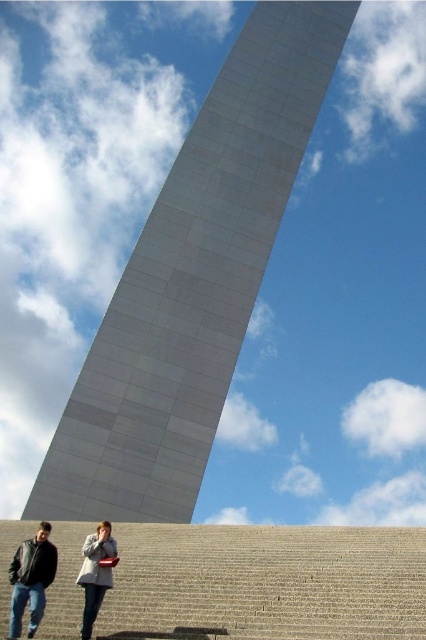
Does gray concrete stairs at lower center have a greater width compared to light gray wool coat at lower center?

Correct, the width of gray concrete stairs at lower center exceeds that of light gray wool coat at lower center.

Identify the location of gray concrete stairs at lower center. This screenshot has height=640, width=426. point(267,582).

Who is more distant from viewer, (371, 608) or (109, 586)?

Positioned behind is point (109, 586).

Identify the location of gray concrete stairs at lower center. This screenshot has height=640, width=426. (267, 582).

Can you confirm if white smooth arch at center is bigger than black leather jacket at lower left?

Yes, white smooth arch at center is bigger than black leather jacket at lower left.

Where is `white smooth arch at center`? white smooth arch at center is located at coordinates (192, 282).

The image size is (426, 640). In order to click on white smooth arch at center in this screenshot , I will do `click(192, 282)`.

Between gray concrete stairs at lower center and matte black jacket at lower left, which one is positioned higher?

Positioned higher is matte black jacket at lower left.

From the picture: Does gray concrete stairs at lower center come behind matte black jacket at lower left?

No.

You are a GUI agent. You are given a task and a screenshot of the screen. Output one action in this format:
    pyautogui.click(x=<x>, y=<y>)
    Task: Click on the gray concrete stairs at lower center
    The height and width of the screenshot is (640, 426).
    Given the screenshot: What is the action you would take?
    pyautogui.click(x=267, y=582)

This screenshot has height=640, width=426. Identify the location of gray concrete stairs at lower center. (267, 582).